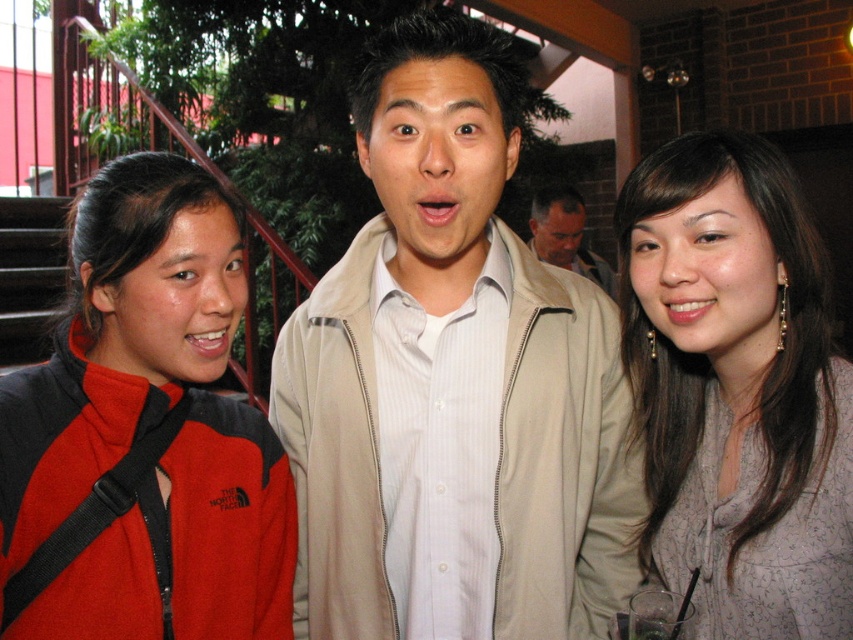
Question: Which of the following is the farthest from the observer?

Choices:
 (A) red fleece jacket at left
 (B) beige fabric jacket at center
 (C) light beige jacket at center

Answer: (C)

Question: Observing the image, what is the correct spatial positioning of beige fabric jacket at center in reference to light beige jacket at center?

Choices:
 (A) above
 (B) below

Answer: (B)

Question: Which point is farther to the camera?

Choices:
 (A) red fleece jacket at left
 (B) matte gray blouse at center

Answer: (B)

Question: Which of the following is the closest to the observer?

Choices:
 (A) (821, 634)
 (B) (500, 84)

Answer: (A)

Question: Does red fleece jacket at left have a larger size compared to light beige jacket at center?

Choices:
 (A) yes
 (B) no

Answer: (B)

Question: Does red fleece jacket at left have a greater width compared to matte gray blouse at center?

Choices:
 (A) yes
 (B) no

Answer: (A)